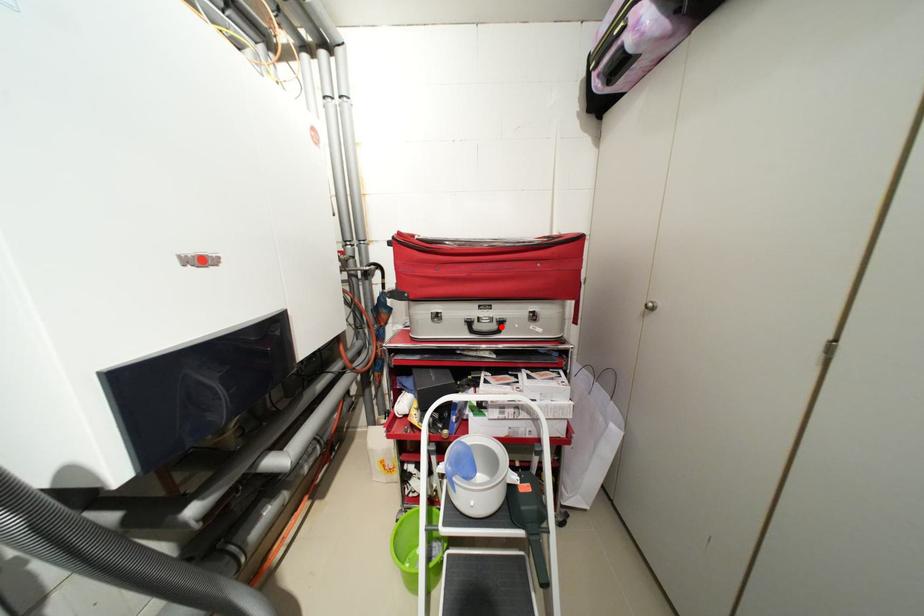
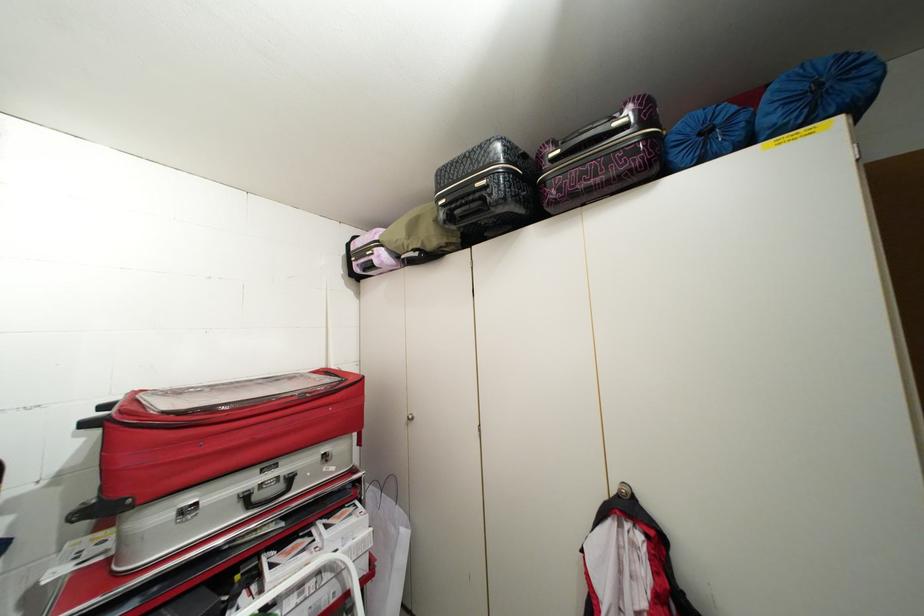
Find the pixel in the second image that matches the highlighted location in the first image.

(287, 487)